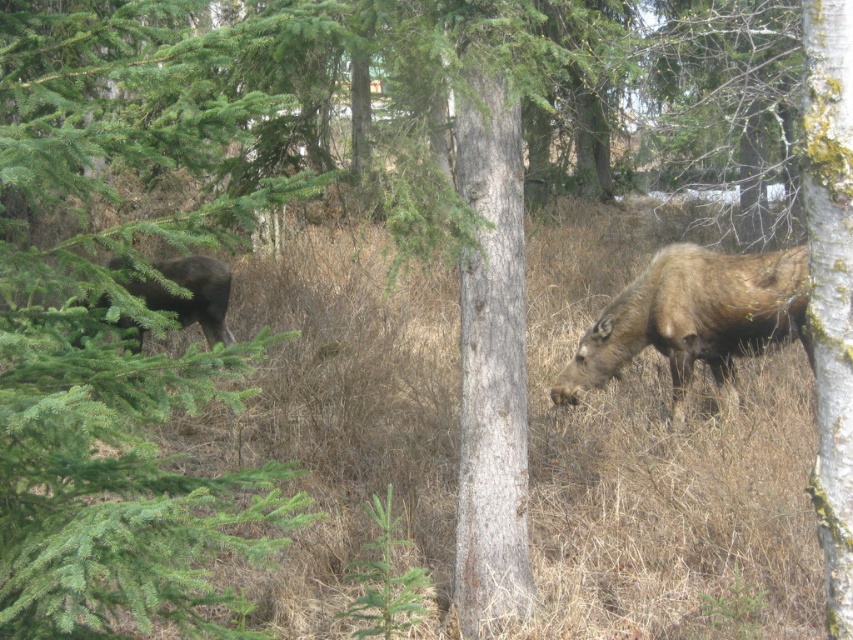
You are a wildlife photographer standing in the forest. You want to capture a clear photo of the brown furry moose at right without disturbing it. Considering the distance, should you use a telephoto lens or a wide angle lens?

The brown furry moose at right is 7.70 meters away from the viewer. Since telephoto lenses are ideal for capturing distant subjects while keeping them in focus and magnified, you should use a telephoto lens to get a clear photo without needing to approach the moose closely.

You are a photographer trying to capture a closeup shot of the moose in the forest. You have two points marked in the scene, point A at coordinates point (561, 403) and point B at coordinates point (189, 273). Which point should you focus on to get a closer shot of the moose?

Point A at coordinates point (561, 403) is closer to the camera than point B at coordinates point (189, 273), so focusing on point A will provide a closer shot of the moose.

You are a hiker trying to spot wildlife in the forest. You see the brown furry moose at right and the dark brown fur at left. Which moose is closer to the ground?

The brown furry moose at right is located below dark brown fur at left, so the brown furry moose at right is closer to the ground.